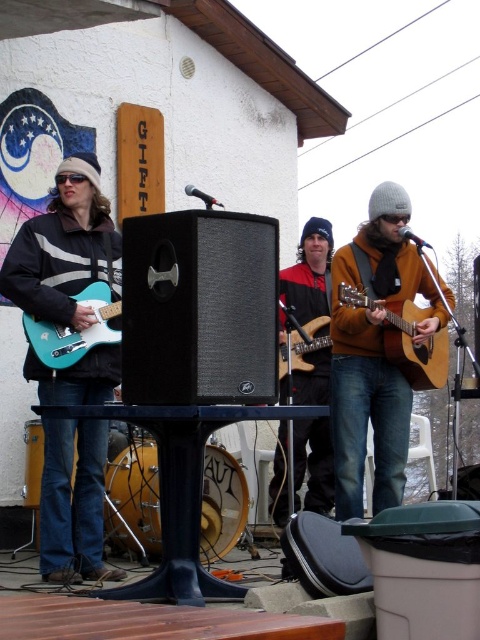
Who is lower down, reddish-brown leather guitar at center or teal glossy electric guitar at left?

reddish-brown leather guitar at center is below.

In the scene shown: Is reddish-brown leather guitar at center above teal glossy electric guitar at left?

Actually, reddish-brown leather guitar at center is below teal glossy electric guitar at left.

Is point (330, 252) positioned before point (72, 296)?

No.

Locate an element on the screen. reddish-brown leather guitar at center is located at coordinates (310, 273).

Can you confirm if matte black guitar at left is smaller than wooden acoustic guitar at center?

Yes.

Image resolution: width=480 pixels, height=640 pixels. In order to click on matte black guitar at left in this screenshot , I will do point(64,248).

At what (x,y) coordinates should I click in order to perform the action: click on matte black guitar at left. Please return your answer as a coordinate pair (x, y). Looking at the image, I should click on (64, 248).

Is point (92, 173) positioned behind point (360, 372)?

No.

Which is in front, point (22, 232) or point (349, 260)?

Point (22, 232)

This screenshot has height=640, width=480. What are the coordinates of `matte black guitar at left` in the screenshot? It's located at (64, 248).